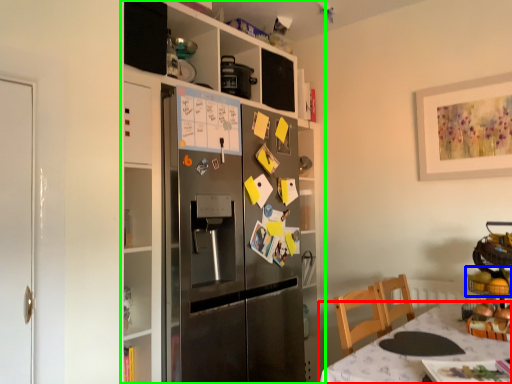
Question: Estimate the real-world distances between objects in this image. Which object is farther from table (highlighted by a red box), food (highlighted by a blue box) or cabinetry (highlighted by a green box)?

Choices:
 (A) food
 (B) cabinetry

Answer: (B)